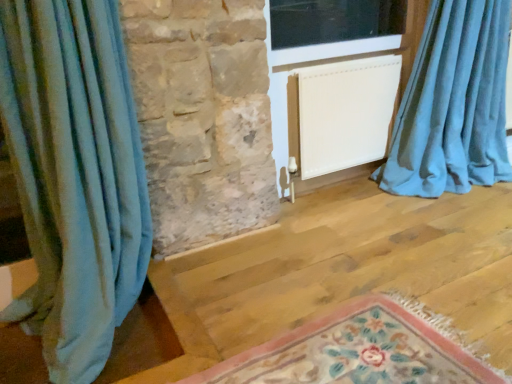
You are a GUI agent. You are given a task and a screenshot of the screen. Output one action in this format:
    pyautogui.click(x=<x>, y=<y>)
    Task: Click on the free space that is in between blue velvet curtain at right, which appears as the 2th curtain when viewed from the left, and floral rug at lower center
    This screenshot has width=512, height=384.
    Given the screenshot: What is the action you would take?
    pyautogui.click(x=382, y=253)